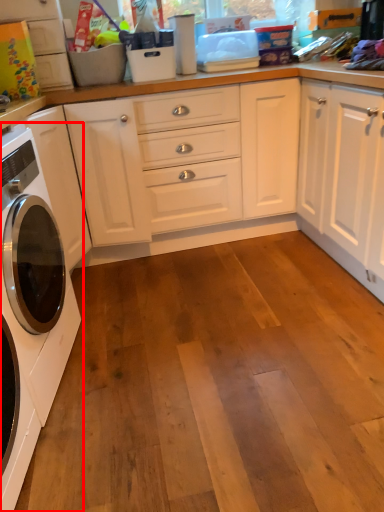
Question: Observing the image, what is the correct spatial positioning of washing machine (annotated by the red box) in reference to cabinetry?

Choices:
 (A) left
 (B) right

Answer: (B)